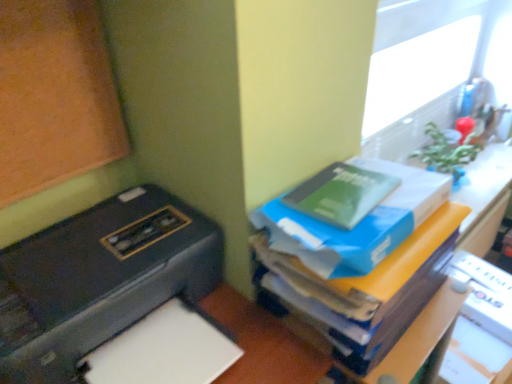
Image resolution: width=512 pixels, height=384 pixels. I want to click on free space above white paper at lower left (from a real-world perspective), so click(x=165, y=344).